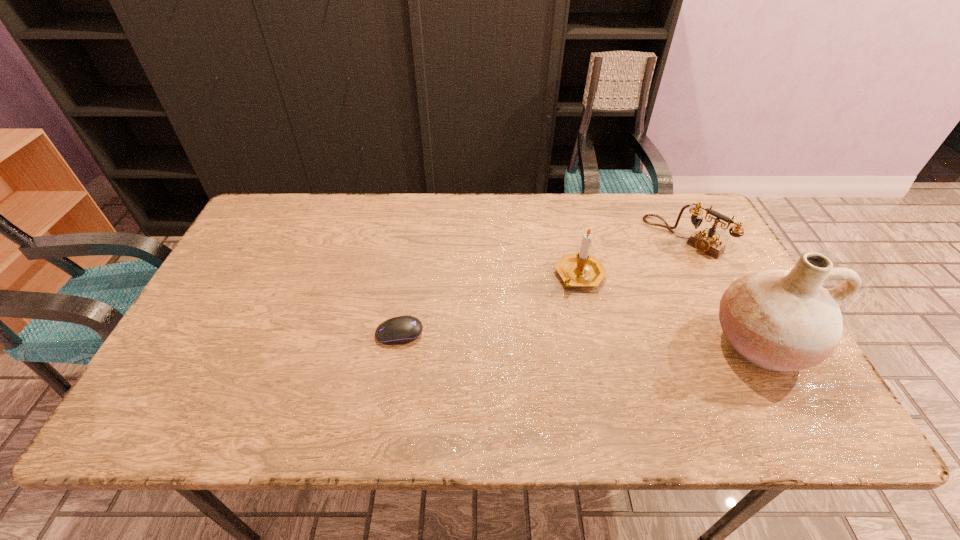
Identify the location of vacant space located with a handle on the third shortest object. Image resolution: width=960 pixels, height=540 pixels. (575, 310).

The image size is (960, 540). In order to click on free region located with a handle on the third shortest object in this screenshot , I will do `click(574, 319)`.

Where is `free region located with a handle on the third shortest object`? This screenshot has width=960, height=540. free region located with a handle on the third shortest object is located at coordinates (570, 348).

Find the location of a particular element. object located at the far edge is located at coordinates (708, 243).

This screenshot has width=960, height=540. Identify the location of object situated at the near edge. (780, 320).

You are a GUI agent. You are given a task and a screenshot of the screen. Output one action in this format:
    pyautogui.click(x=<x>, y=<y>)
    Task: Click on the pottery that is at the right edge
    The width and height of the screenshot is (960, 540).
    Given the screenshot: What is the action you would take?
    pyautogui.click(x=780, y=320)

Find the location of a particular element. This screenshot has width=960, height=540. telephone present at the right edge is located at coordinates (708, 243).

What are the coordinates of `object present at the far right corner` in the screenshot? It's located at (708, 243).

Find the location of a particular element. This screenshot has height=540, width=960. object that is positioned at the near right corner is located at coordinates (780, 320).

The height and width of the screenshot is (540, 960). In order to click on free space at the far edge of the desktop in this screenshot , I will do `click(555, 213)`.